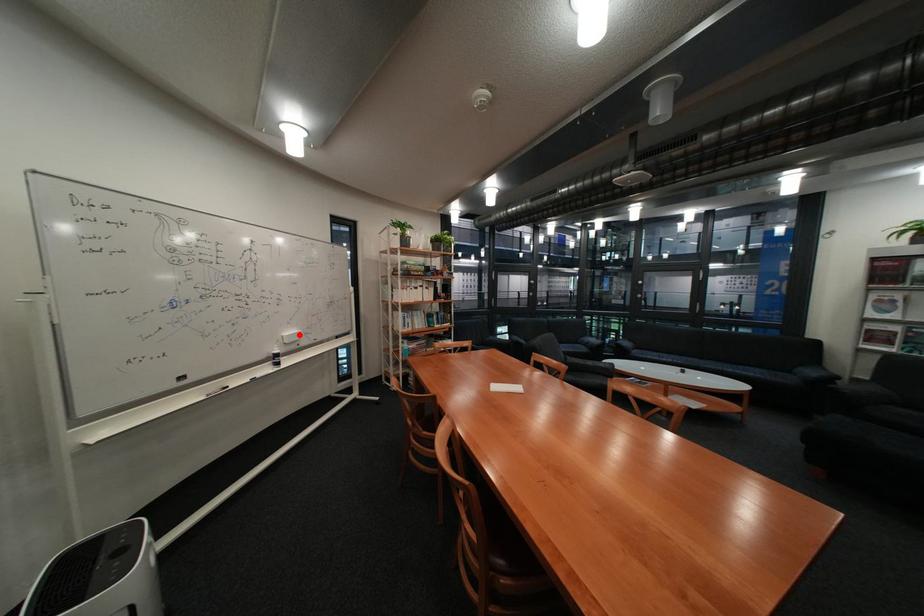
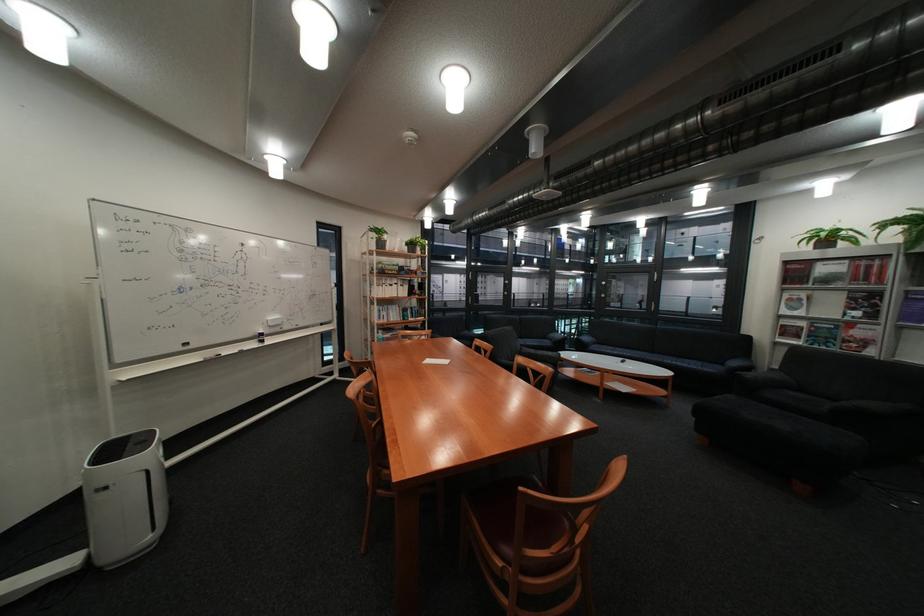
Question: I am providing you with two images of the same scene from different viewpoints. Image1 has a red point marked. In image2, the corresponding 3D location appears at what relative position? Reply with the corresponding letter.

Choices:
 (A) Closer
 (B) Farther

Answer: (B)